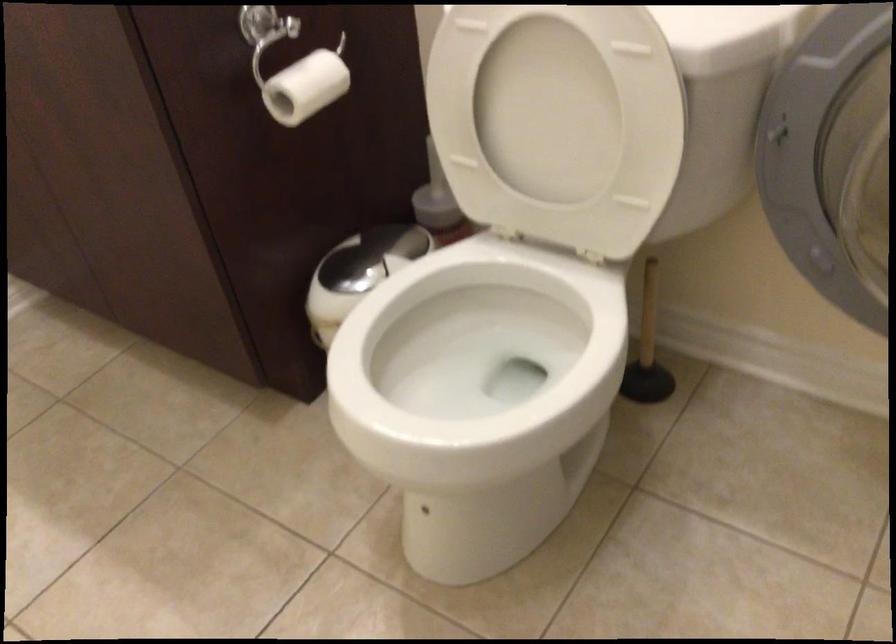
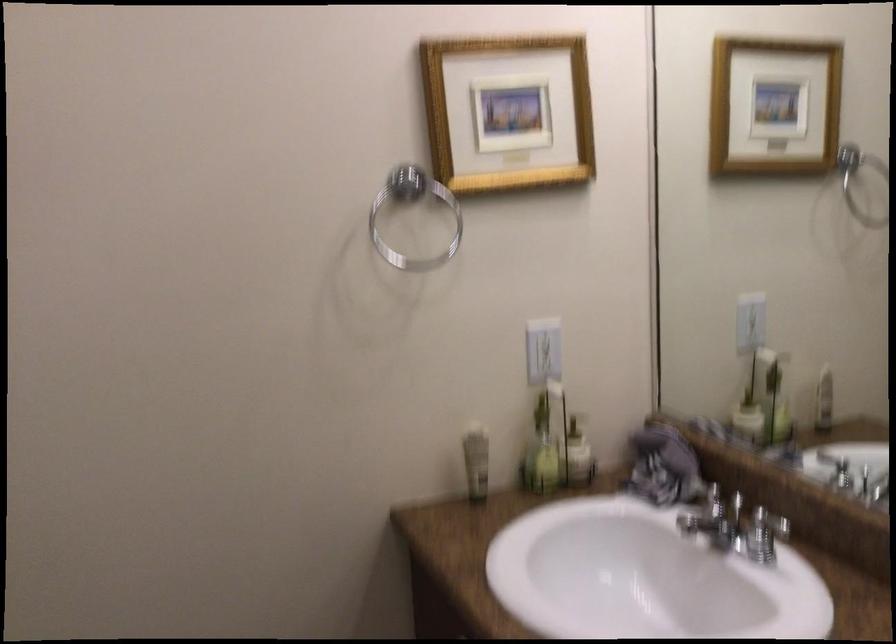
The images are taken continuously from a first-person perspective. In which direction is your viewpoint rotating?

The camera's rotation is toward left-up.